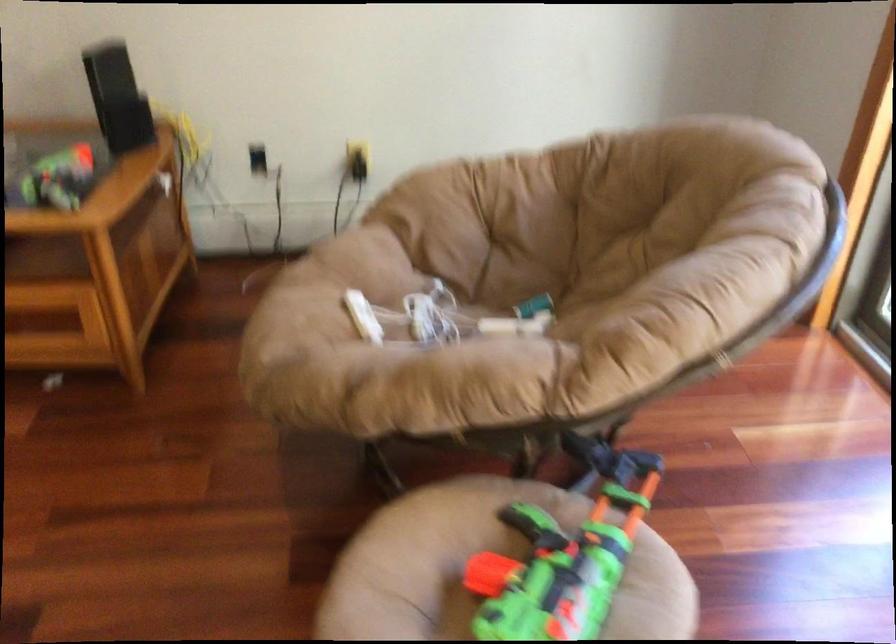
The height and width of the screenshot is (644, 896). I want to click on ottoman sitting surface, so click(x=95, y=263).